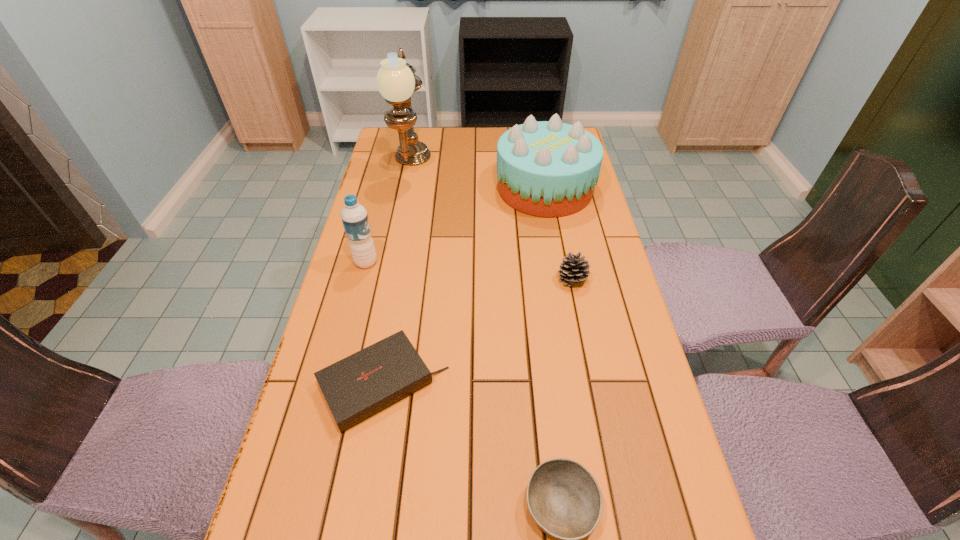
Image resolution: width=960 pixels, height=540 pixels. I want to click on free space located 0.090m on the back of the Bible, so click(396, 312).

Where is `object that is at the far edge`? The width and height of the screenshot is (960, 540). object that is at the far edge is located at coordinates (396, 81).

The height and width of the screenshot is (540, 960). I want to click on oil lamp that is at the left edge, so click(396, 81).

This screenshot has width=960, height=540. What are the coordinates of `water bottle that is at the left edge` in the screenshot? It's located at (354, 216).

Find the location of `Bible at the left edge`. Bible at the left edge is located at coordinates (361, 385).

The width and height of the screenshot is (960, 540). Find the location of `cake located in the right edge section of the desktop`. cake located in the right edge section of the desktop is located at coordinates (548, 168).

Locate an element on the screen. The height and width of the screenshot is (540, 960). pinecone that is at the right edge is located at coordinates (573, 269).

You are a GUI agent. You are given a task and a screenshot of the screen. Output one action in this format:
    pyautogui.click(x=<x>, y=<y>)
    Task: Click on the object present at the far left corner
    This screenshot has width=960, height=540.
    Given the screenshot: What is the action you would take?
    pyautogui.click(x=396, y=81)

Locate an element on the screen. This screenshot has width=960, height=540. free space at the far edge of the desktop is located at coordinates (468, 126).

This screenshot has height=540, width=960. In the image, there is a desktop. Identify the location of vacant space at the left edge. (416, 168).